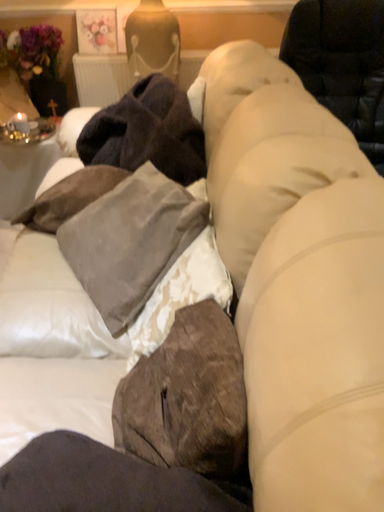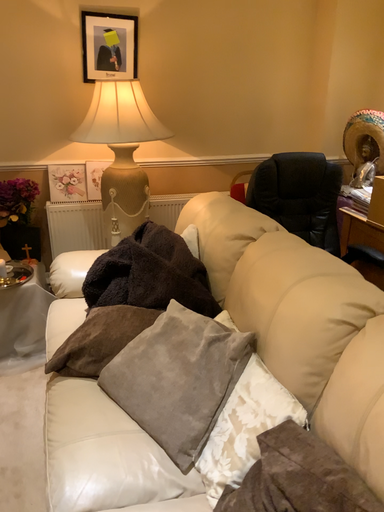
Question: Which way did the camera rotate in the video?

Choices:
 (A) rotated downward
 (B) rotated upward

Answer: (B)